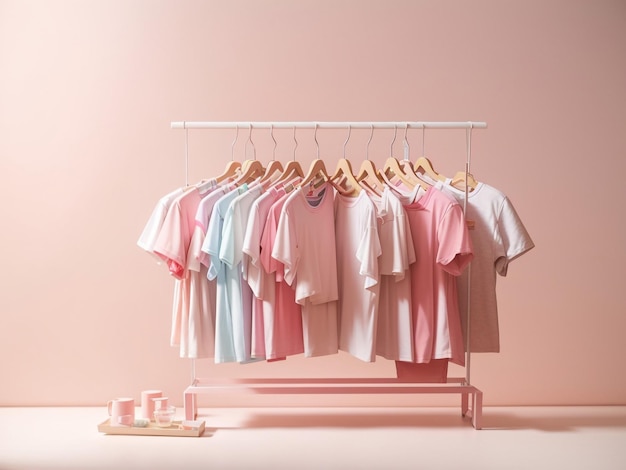
The image size is (626, 470). In order to click on wooden hangers in this screenshot , I will do `click(228, 168)`, `click(250, 168)`, `click(272, 165)`, `click(292, 165)`, `click(316, 164)`, `click(345, 165)`, `click(367, 165)`, `click(392, 167)`, `click(422, 163)`, `click(409, 170)`.